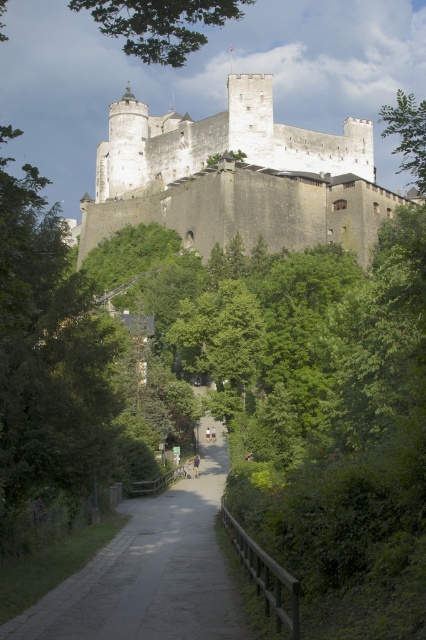
You are standing at the base of the hill and see the white stone castle at upper center and the gray concrete path at center. Which object is closer to you?

The gray concrete path at center is closer to you because the white stone castle at upper center is further away.

You are standing at the base of the hill looking up at the white stone castle at upper center and the green leafy tree at upper right. Which object is closer to you?

The white stone castle at upper center is closer to you than the green leafy tree at upper right.

You are standing at the base of the hill where the pathway begins. Looking up towards the castle, where would you see the white stone castle at upper center located in your field of view?

The white stone castle at upper center is located at the coordinates 0.278 on the x axis and 0.554 on the y axis in your field of view.